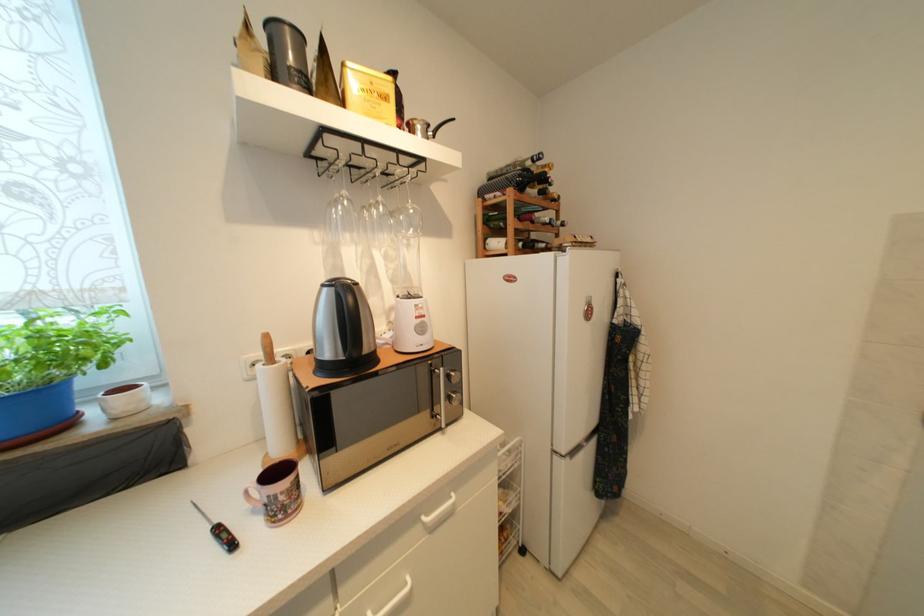
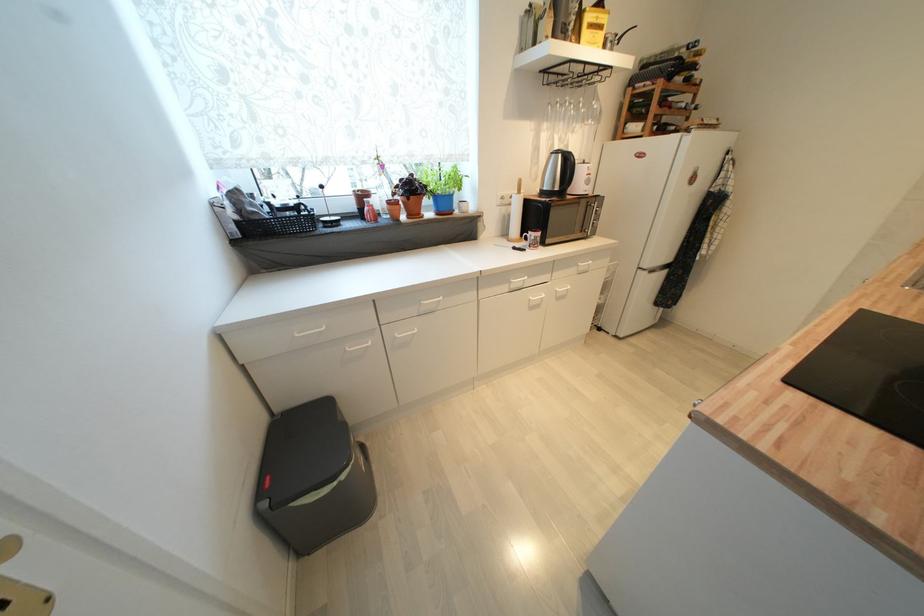
Where in the second image is the point corresponding to point (77, 353) from the first image?

(463, 184)